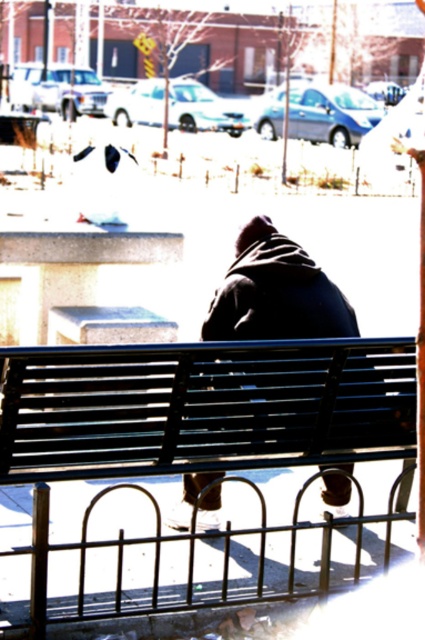
Which of these two, black metal bench at center or dark blue jacket at center, stands shorter?

With less height is dark blue jacket at center.

The width and height of the screenshot is (425, 640). I want to click on black metal bench at center, so click(192, 422).